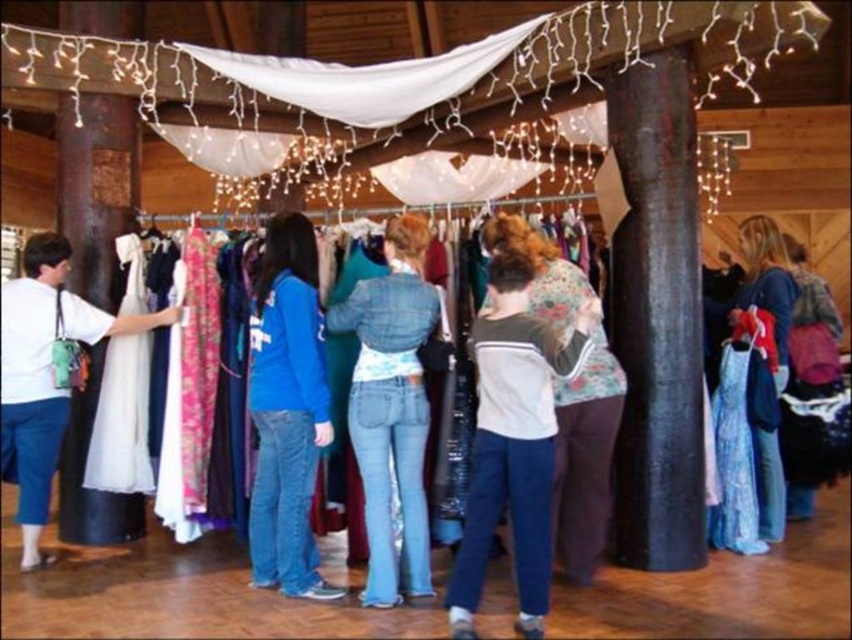
Question: Is blue denim jeans at center smaller than white matte dress at left?

Choices:
 (A) yes
 (B) no

Answer: (A)

Question: Is gray cotton sweatshirt at center further to camera compared to white matte dress at left?

Choices:
 (A) yes
 (B) no

Answer: (B)

Question: Which point is closer to the camera taking this photo?

Choices:
 (A) (394, 332)
 (B) (566, 429)
 (C) (262, 449)
 (D) (91, 333)

Answer: (A)

Question: Does denim jeans at center come behind floral-patterned sweater at center?

Choices:
 (A) yes
 (B) no

Answer: (A)

Question: Which point is farther to the camera?

Choices:
 (A) (14, 413)
 (B) (816, 396)

Answer: (B)

Question: Which of the following is the closest to the observer?

Choices:
 (A) (735, 301)
 (B) (556, 349)
 (C) (30, 440)

Answer: (B)